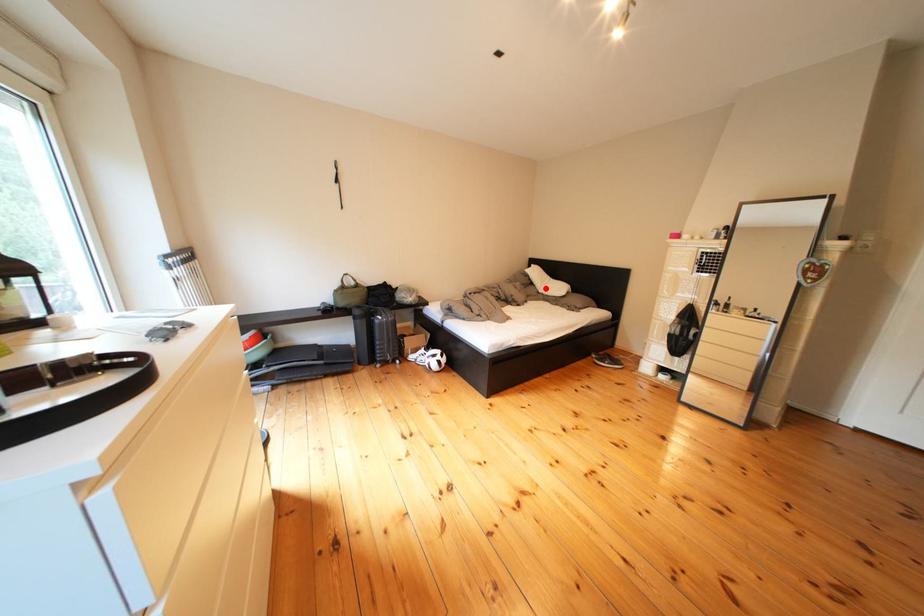
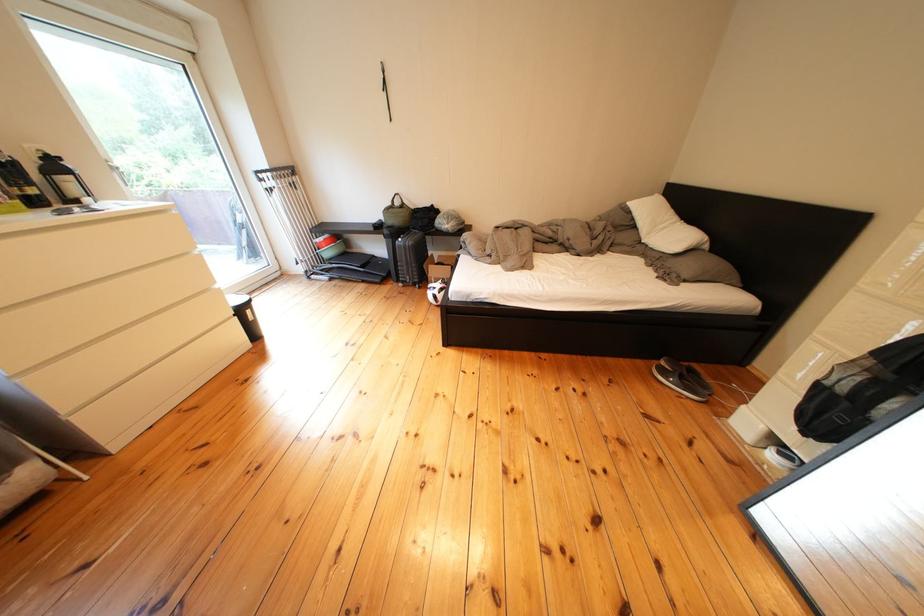
The point at the highlighted location is marked in the first image. Where is the corresponding point in the second image?

(649, 230)